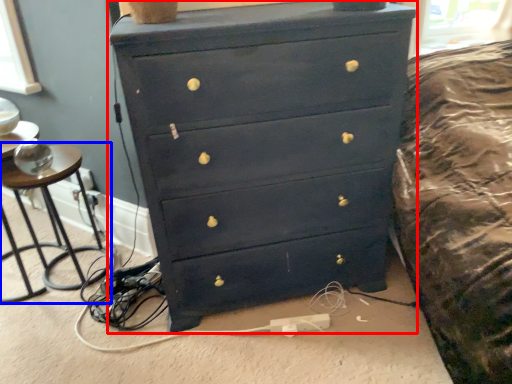
Question: Which object appears farthest to the camera in this image, chest of drawers (highlighted by a red box) or side table (highlighted by a blue box)?

Choices:
 (A) chest of drawers
 (B) side table

Answer: (B)